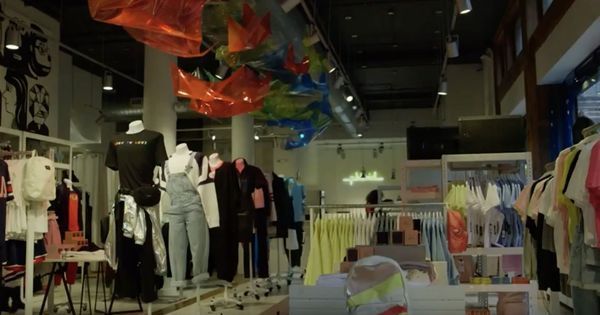
You are a GUI agent. You are given a task and a screenshot of the screen. Output one action in this format:
    pyautogui.click(x=<x>, y=<y>)
    Task: Click on the white table
    
    Given the screenshot: What is the action you would take?
    pyautogui.click(x=320, y=285), pyautogui.click(x=80, y=255)